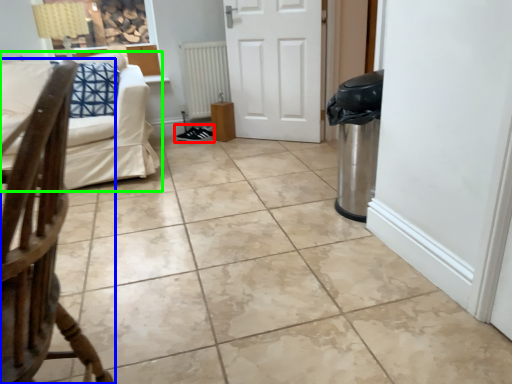
Question: Estimate the real-world distances between objects in this image. Which object is farther from footwear (highlighted by a red box), chair (highlighted by a blue box) or studio couch (highlighted by a green box)?

Choices:
 (A) chair
 (B) studio couch

Answer: (A)